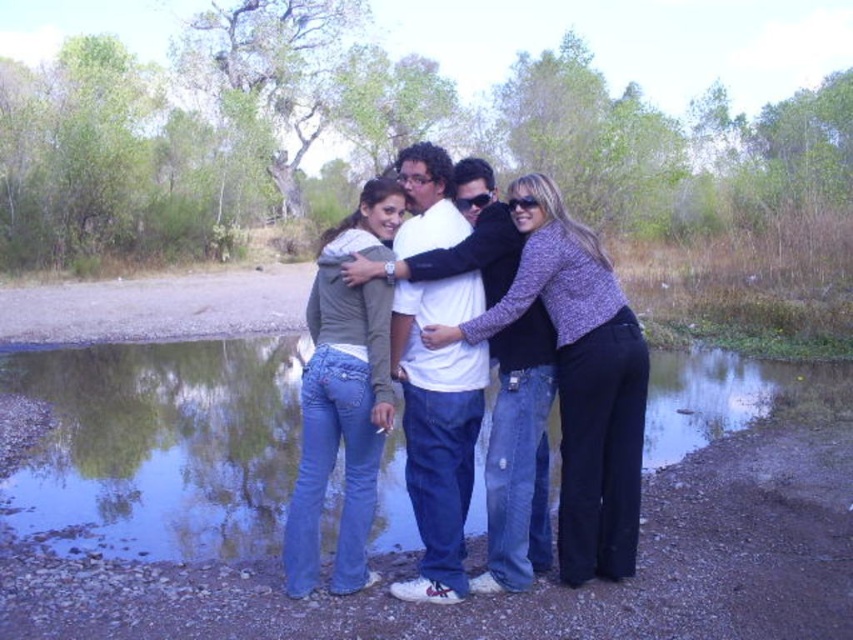
Who is taller, green reflective water at center or denim jeans at center?

denim jeans at center is taller.

Between point (735, 406) and point (454, 212), which one is positioned in front?

Point (454, 212) is more forward.

Which is in front, point (729, 401) or point (543, 316)?

Point (543, 316) is in front.

Image resolution: width=853 pixels, height=640 pixels. What are the coordinates of `green reflective water at center` in the screenshot? It's located at (160, 448).